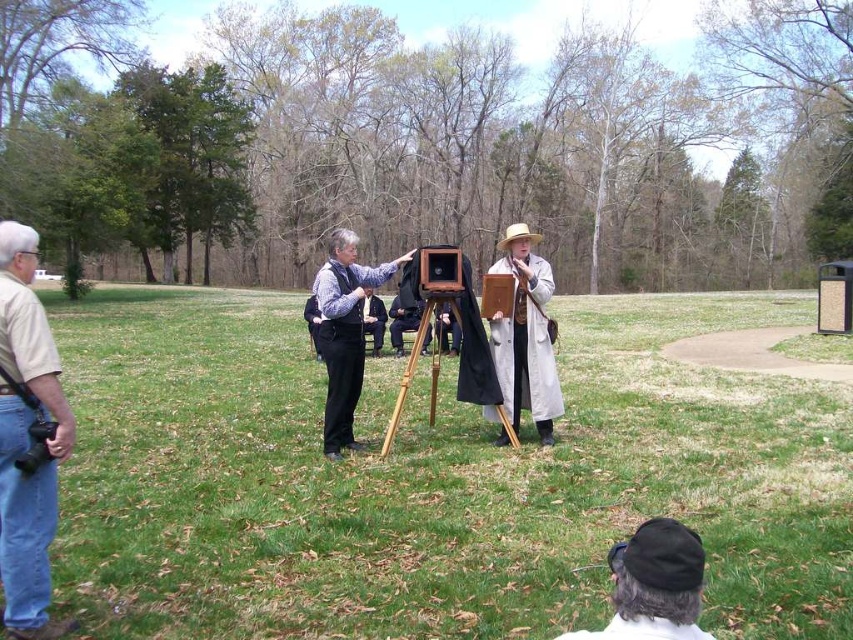
You are a photographer setting up a vintage camera in the park. You have a dark gray wool hat at lower center and a light beige fabric coat at center. Which item takes up more space in the scene?

The light beige fabric coat at center takes up more space than the dark gray wool hat at lower center.